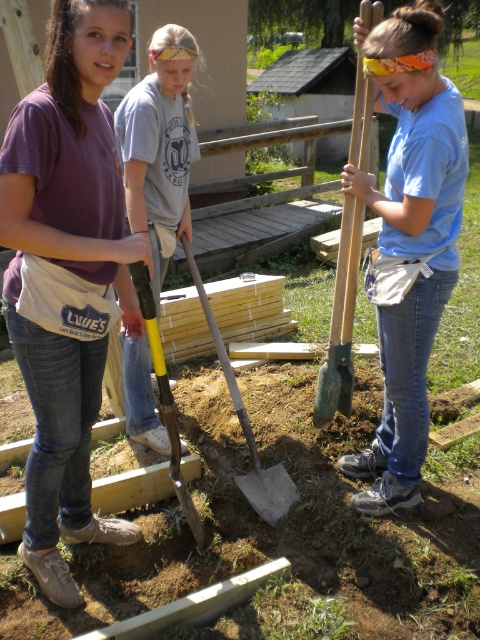
Question: Which of the following is the closest to the observer?

Choices:
 (A) (x=144, y=204)
 (B) (x=278, y=484)

Answer: (A)

Question: Which point is farther to the camera?

Choices:
 (A) (163, 61)
 (B) (333, 408)
 (C) (74, 417)

Answer: (B)

Question: Is gray cotton t-shirt at center further to camera compared to green wood shovel at center?

Choices:
 (A) no
 (B) yes

Answer: (A)

Question: Does matte purple shirt at upper left appear under gray cotton t-shirt at center?

Choices:
 (A) yes
 (B) no

Answer: (A)

Question: Which point is closer to the camera taking this photo?

Choices:
 (A) (347, 230)
 (B) (249, 432)
 (C) (381, 65)

Answer: (C)

Question: Considering the relative positions of blue matte shirt at center and yellow handle shovel at center in the image provided, where is blue matte shirt at center located with respect to yellow handle shovel at center?

Choices:
 (A) above
 (B) below

Answer: (A)